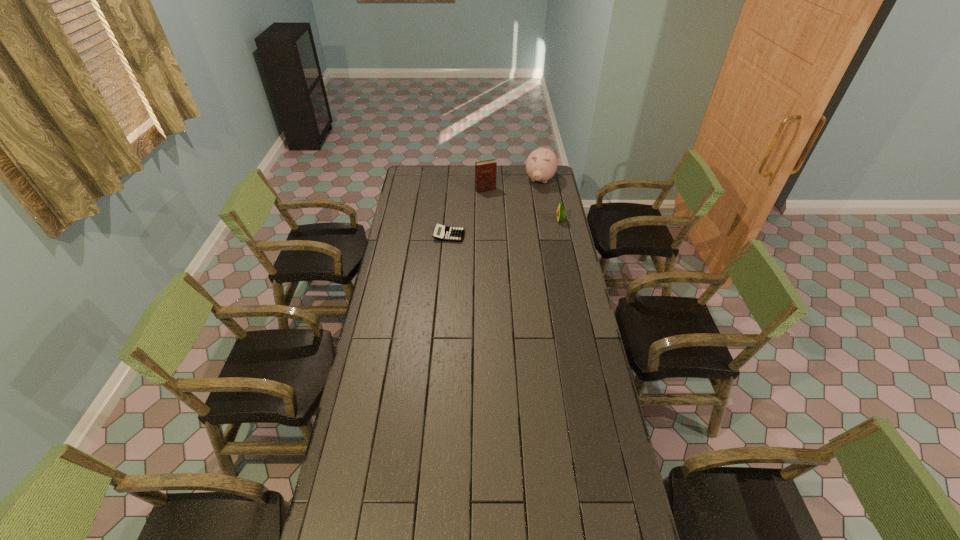
Identify the location of free location that satisfies the following two spatial constraints: 1. on the back side of the leftmost object; 2. on the right side of the diary. The image size is (960, 540). (453, 190).

The width and height of the screenshot is (960, 540). In order to click on vacant space that satisfies the following two spatial constraints: 1. on the back side of the third tallest object; 2. on the cut side of the calculator in this screenshot , I will do `click(450, 220)`.

The width and height of the screenshot is (960, 540). In order to click on free space in the image that satisfies the following two spatial constraints: 1. on the front side of the piggy bank; 2. on the cut side of the avocado in this screenshot , I will do `click(547, 220)`.